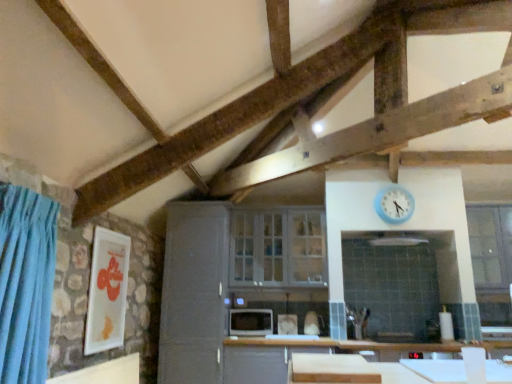
I want to click on free region under matte white picture frame at left (from a real-world perspective), so click(x=98, y=360).